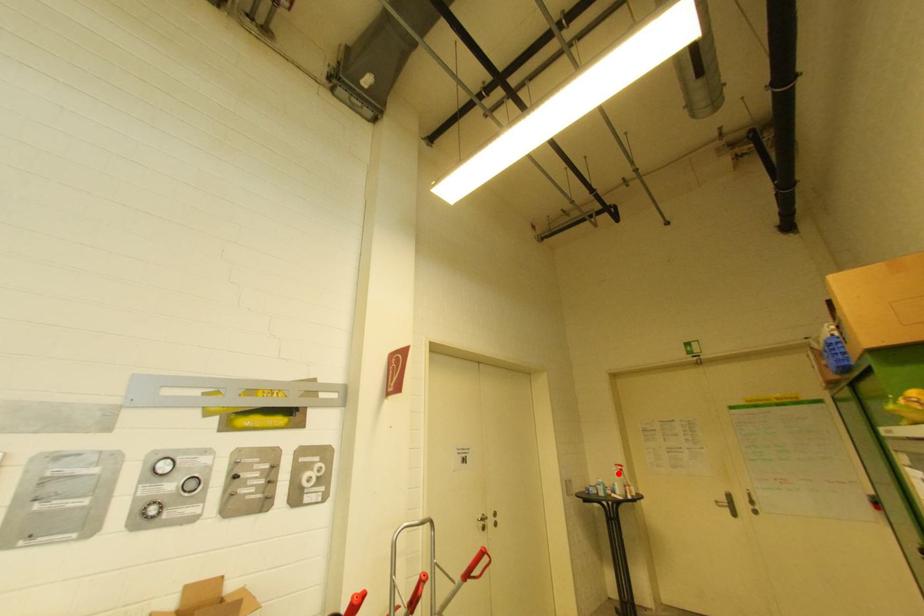
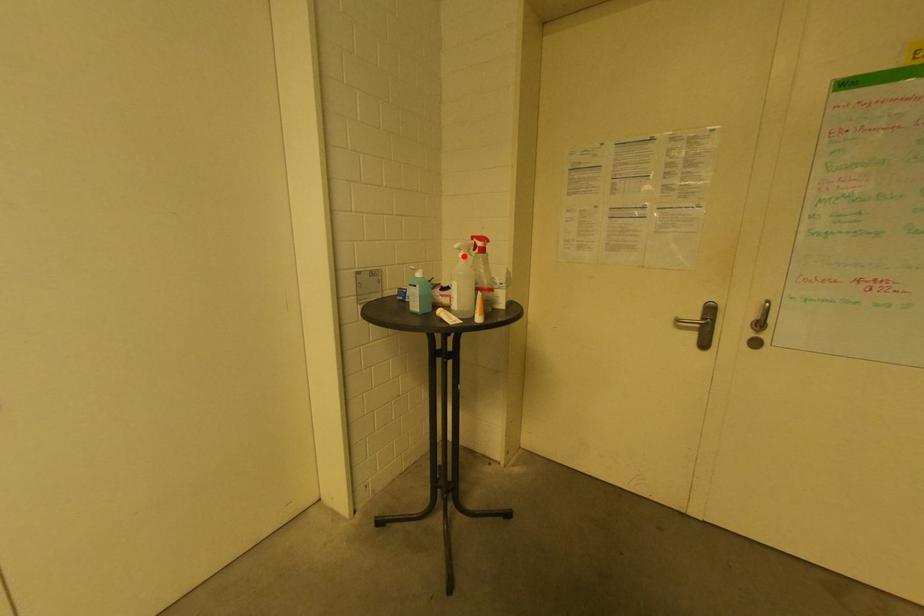
I am providing you with two images of the same scene from different viewpoints. A red point is marked on the first image and another point is marked on the second image. Is the marked point in image1 the same physical position as the marked point in image2?

Yes